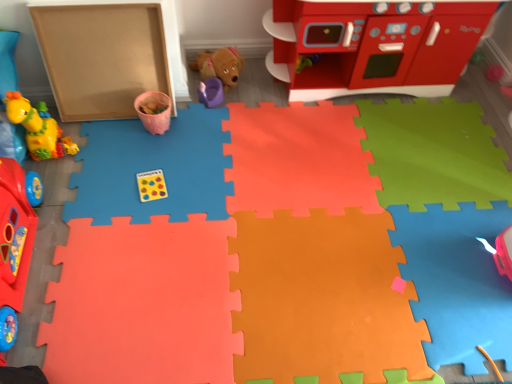
Locate an element on the screen. This screenshot has height=384, width=512. matte cardboard box at left is located at coordinates (108, 54).

The image size is (512, 384). Describe the element at coordinates (14, 234) in the screenshot. I see `rubber duck at left, which is the seventh toy from right to left` at that location.

Where is `smooth plastic play kitchen at upper right, which is the 7th toy from left to right`? The width and height of the screenshot is (512, 384). smooth plastic play kitchen at upper right, which is the 7th toy from left to right is located at coordinates (373, 45).

Find the location of a particular element. This screenshot has width=512, height=384. matte yellow giraffe at left, which is the sixth toy in right-to-left order is located at coordinates (38, 128).

In order to face pink matte cup at upper center, marked as the 5th toy in a right-to-left arrangement, should I rotate leftwards or rightwards?

It's best to rotate left around 13.649 degrees.

In order to face rubber duck at left, the 6th toy from the left, should I rotate leftwards or rightwards?

A 7.475 degree turn to the right will do.

What do you see at coordinates (211, 92) in the screenshot? I see `purple plastic cup at center, the 4th toy in the right-to-left sequence` at bounding box center [211, 92].

Find the location of a particular element. The image size is (512, 384). matte cardboard box at left is located at coordinates (108, 54).

From a real-world perspective, is smooth plastic play kitchen at upper right, which is the 7th toy from left to right, above or below rubber duck at left, the 6th toy from the left?

Clearly, from a real-world perspective, smooth plastic play kitchen at upper right, which is the 7th toy from left to right, is above rubber duck at left, the 6th toy from the left.

Is point (297, 3) positioned after point (368, 229)?

Yes, it is behind point (368, 229).

Based on the photo, would you consider smooth plastic play kitchen at upper right, which is the 7th toy from left to right, to be distant from rubber duck at left, which appears as the 2th toy when viewed from the right?

smooth plastic play kitchen at upper right, which is the 7th toy from left to right, is near rubber duck at left, which appears as the 2th toy when viewed from the right, not far away.

Is smooth plastic play kitchen at upper right, which is the 7th toy from left to right, to the left of rubber duck at left, the 6th toy from the left, from the viewer's perspective?

No, smooth plastic play kitchen at upper right, which is the 7th toy from left to right, is not to the left of rubber duck at left, the 6th toy from the left.

Is brown plush dog at center, positioned as the third toy in right-to-left order, facing away from matte yellow giraffe at left, which is the sixth toy in right-to-left order?

No.

Can you confirm if brown plush dog at center, positioned as the third toy in right-to-left order, is smaller than matte yellow giraffe at left, which is the sixth toy in right-to-left order?

Correct, brown plush dog at center, positioned as the third toy in right-to-left order, occupies less space than matte yellow giraffe at left, which is the sixth toy in right-to-left order.

Is pink matte cup at upper center, acting as the third toy starting from the left, next to matte yellow giraffe at left, which is the sixth toy in right-to-left order, and touching it?

pink matte cup at upper center, acting as the third toy starting from the left, and matte yellow giraffe at left, which is the sixth toy in right-to-left order, are not in contact.

Can you tell me how much pink matte cup at upper center, marked as the 5th toy in a right-to-left arrangement, and matte yellow giraffe at left, the second toy viewed from the left, differ in facing direction?

The angle between the facing direction of pink matte cup at upper center, marked as the 5th toy in a right-to-left arrangement, and the facing direction of matte yellow giraffe at left, the second toy viewed from the left, is 0.00129 degrees.

In the scene shown: Is pink matte cup at upper center, marked as the 5th toy in a right-to-left arrangement, oriented towards matte yellow giraffe at left, the second toy viewed from the left?

No, pink matte cup at upper center, marked as the 5th toy in a right-to-left arrangement, is not turned towards matte yellow giraffe at left, the second toy viewed from the left.

Considering the positions of objects pink matte cup at upper center, acting as the third toy starting from the left, and matte yellow giraffe at left, the second toy viewed from the left, in the image provided, who is behind, pink matte cup at upper center, acting as the third toy starting from the left, or matte yellow giraffe at left, the second toy viewed from the left,?

Positioned behind is pink matte cup at upper center, acting as the third toy starting from the left.

Which of these two, matte yellow giraffe at left, which is the sixth toy in right-to-left order, or rubber duck at left, which is the seventh toy from right to left, is wider?

matte yellow giraffe at left, which is the sixth toy in right-to-left order, is wider.

Is matte yellow giraffe at left, the second toy viewed from the left, completely or partially outside of rubber duck at left, which is the seventh toy from right to left?

That's correct, matte yellow giraffe at left, the second toy viewed from the left, is outside of rubber duck at left, which is the seventh toy from right to left.

From the image's perspective, does matte yellow giraffe at left, which is the sixth toy in right-to-left order, appear lower than rubber duck at left, which is the seventh toy from right to left?

No, from the image's perspective, matte yellow giraffe at left, which is the sixth toy in right-to-left order, is not beneath rubber duck at left, which is the seventh toy from right to left.

Considering the relative positions of matte yellow giraffe at left, the second toy viewed from the left, and rubber duck at left, which is the seventh toy from right to left, in the image provided, is matte yellow giraffe at left, the second toy viewed from the left, to the right of rubber duck at left, which is the seventh toy from right to left, from the viewer's perspective?

Indeed, matte yellow giraffe at left, the second toy viewed from the left, is positioned on the right side of rubber duck at left, which is the seventh toy from right to left.

Is point (404, 27) closer to camera compared to point (11, 119)?

No.

Is smooth plastic play kitchen at upper right, acting as the 1th toy starting from the right, facing away from matte yellow giraffe at left, which is the sixth toy in right-to-left order?

No, smooth plastic play kitchen at upper right, acting as the 1th toy starting from the right, is not facing away from matte yellow giraffe at left, which is the sixth toy in right-to-left order.

Is smooth plastic play kitchen at upper right, acting as the 1th toy starting from the right, taller than matte yellow giraffe at left, the second toy viewed from the left?

Indeed, smooth plastic play kitchen at upper right, acting as the 1th toy starting from the right, has a greater height compared to matte yellow giraffe at left, the second toy viewed from the left.

Is smooth plastic play kitchen at upper right, acting as the 1th toy starting from the right, located outside matte yellow giraffe at left, which is the sixth toy in right-to-left order?

That's correct, smooth plastic play kitchen at upper right, acting as the 1th toy starting from the right, is outside of matte yellow giraffe at left, which is the sixth toy in right-to-left order.

From the image's perspective, which one is positioned lower, pink matte cup at upper center, marked as the 5th toy in a right-to-left arrangement, or purple plastic cup at center, the fourth toy from the left?

pink matte cup at upper center, marked as the 5th toy in a right-to-left arrangement, is shown below in the image.

Considering the relative positions of pink matte cup at upper center, acting as the third toy starting from the left, and purple plastic cup at center, the 4th toy in the right-to-left sequence, in the image provided, is pink matte cup at upper center, acting as the third toy starting from the left, to the left of purple plastic cup at center, the 4th toy in the right-to-left sequence, from the viewer's perspective?

Yes, pink matte cup at upper center, acting as the third toy starting from the left, is to the left of purple plastic cup at center, the 4th toy in the right-to-left sequence.

Who is shorter, pink matte cup at upper center, marked as the 5th toy in a right-to-left arrangement, or purple plastic cup at center, the 4th toy in the right-to-left sequence?

purple plastic cup at center, the 4th toy in the right-to-left sequence.

Is pink matte cup at upper center, marked as the 5th toy in a right-to-left arrangement, beside purple plastic cup at center, the fourth toy from the left?

pink matte cup at upper center, marked as the 5th toy in a right-to-left arrangement, and purple plastic cup at center, the fourth toy from the left, are clearly separated.

Does purple plastic cup at center, the fourth toy from the left, have a greater width compared to brown plush dog at center, positioned as the third toy in right-to-left order?

In fact, purple plastic cup at center, the fourth toy from the left, might be narrower than brown plush dog at center, positioned as the third toy in right-to-left order.

From a real-world perspective, who is located higher, purple plastic cup at center, the 4th toy in the right-to-left sequence, or brown plush dog at center, positioned as the third toy in right-to-left order?

In real-world perspective, brown plush dog at center, positioned as the third toy in right-to-left order, is above.

From the image's perspective, is purple plastic cup at center, the 4th toy in the right-to-left sequence, positioned above or below brown plush dog at center, positioned as the third toy in right-to-left order?

purple plastic cup at center, the 4th toy in the right-to-left sequence, is situated lower than brown plush dog at center, positioned as the third toy in right-to-left order, in the image.

Is the depth of purple plastic cup at center, the fourth toy from the left, less than that of brown plush dog at center, placed as the fifth toy when sorted from left to right?

That is False.

Identify the location of the 5th toy below the smooth plastic play kitchen at upper right, which is the 7th toy from left to right (from the image's perspective). (284, 248).

At what (x,y) coordinates should I click in order to perform the action: click on the 2nd toy above the brown plush dog at center, positioned as the third toy in right-to-left order (from a real-world perspective). Please return your answer as a coordinate pair (x, y). The height and width of the screenshot is (384, 512). Looking at the image, I should click on (38, 128).

Considering their positions, is pink matte cup at upper center, marked as the 5th toy in a right-to-left arrangement, positioned further to rubber duck at left, the 1th toy in the left-to-right sequence, than purple plastic cup at center, the fourth toy from the left?

Based on the image, purple plastic cup at center, the fourth toy from the left, appears to be further to rubber duck at left, the 1th toy in the left-to-right sequence.

Based on their spatial positions, is rubber duck at left, the 6th toy from the left, or matte cardboard box at left further from rubber duck at left, which is the seventh toy from right to left?

The object further to rubber duck at left, which is the seventh toy from right to left, is rubber duck at left, the 6th toy from the left.

Looking at this image, looking at the image, which one is located further to brown plush dog at center, positioned as the third toy in right-to-left order, matte yellow giraffe at left, the second toy viewed from the left, or matte cardboard box at left?

matte yellow giraffe at left, the second toy viewed from the left, is positioned further to the anchor brown plush dog at center, positioned as the third toy in right-to-left order.

Considering their positions, is brown plush dog at center, placed as the fifth toy when sorted from left to right, positioned closer to pink matte cup at upper center, acting as the third toy starting from the left, than smooth plastic play kitchen at upper right, which is the 7th toy from left to right?

brown plush dog at center, placed as the fifth toy when sorted from left to right, is positioned closer to the anchor pink matte cup at upper center, acting as the third toy starting from the left.

Considering their positions, is rubber duck at left, the 1th toy in the left-to-right sequence, positioned further to brown plush dog at center, positioned as the third toy in right-to-left order, than purple plastic cup at center, the 4th toy in the right-to-left sequence?

rubber duck at left, the 1th toy in the left-to-right sequence, lies further to brown plush dog at center, positioned as the third toy in right-to-left order, than the other object.

From the image, which object appears to be farther from rubber duck at left, the 6th toy from the left, matte yellow giraffe at left, the second toy viewed from the left, or brown plush dog at center, placed as the fifth toy when sorted from left to right?

brown plush dog at center, placed as the fifth toy when sorted from left to right, is further to rubber duck at left, the 6th toy from the left.

Considering their positions, is matte yellow giraffe at left, which is the sixth toy in right-to-left order, positioned closer to pink matte cup at upper center, acting as the third toy starting from the left, than purple plastic cup at center, the 4th toy in the right-to-left sequence?

Based on the image, purple plastic cup at center, the 4th toy in the right-to-left sequence, appears to be nearer to pink matte cup at upper center, acting as the third toy starting from the left.

Which object lies nearer to the anchor point matte cardboard box at left, rubber duck at left, which appears as the 2th toy when viewed from the right, or brown plush dog at center, positioned as the third toy in right-to-left order?

brown plush dog at center, positioned as the third toy in right-to-left order, is closer to matte cardboard box at left.

This screenshot has width=512, height=384. Find the location of `cardboard box between matte yellow giraffe at left, the second toy viewed from the left, and rubber duck at left, the 6th toy from the left, in the horizontal direction`. cardboard box between matte yellow giraffe at left, the second toy viewed from the left, and rubber duck at left, the 6th toy from the left, in the horizontal direction is located at coordinates (108, 54).

I want to click on cardboard box between rubber duck at left, which is the seventh toy from right to left, and purple plastic cup at center, the 4th toy in the right-to-left sequence, from front to back, so click(108, 54).

You are a GUI agent. You are given a task and a screenshot of the screen. Output one action in this format:
    pyautogui.click(x=<x>, y=<y>)
    Task: Click on the cardboard box between matte yellow giraffe at left, the second toy viewed from the left, and smooth plastic play kitchen at upper right, which is the 7th toy from left to right
    Image resolution: width=512 pixels, height=384 pixels.
    Given the screenshot: What is the action you would take?
    point(108,54)

The height and width of the screenshot is (384, 512). I want to click on cardboard box positioned between rubber duck at left, the 1th toy in the left-to-right sequence, and brown plush dog at center, placed as the fifth toy when sorted from left to right, from near to far, so click(108, 54).